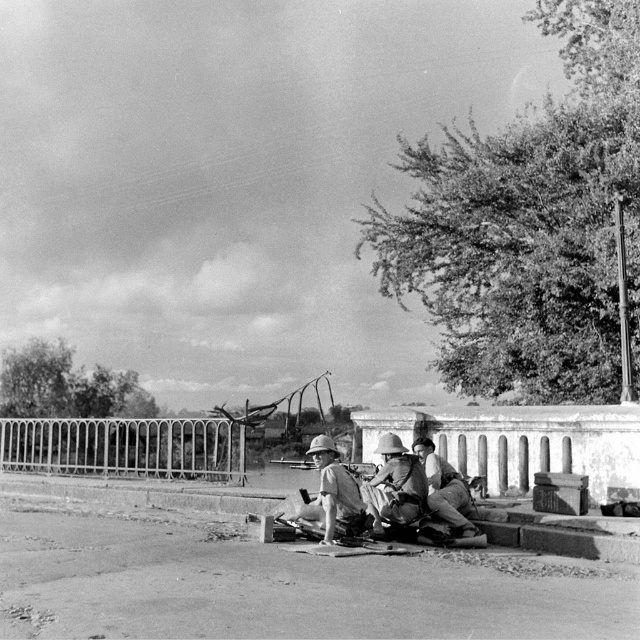
Question: Where is light brown wooden stick at center located in relation to camouflage fabric construction worker at center in the image?

Choices:
 (A) left
 (B) right

Answer: (A)

Question: Which point is closer to the camera?

Choices:
 (A) camouflage fabric construction worker at center
 (B) light brown wooden stick at center

Answer: (B)

Question: Is metallic wire fence at center to the left of camouflage fabric helmet at center from the viewer's perspective?

Choices:
 (A) yes
 (B) no

Answer: (A)

Question: Which object is the closest to the camouflage fabric helmet at center?

Choices:
 (A) metallic wire fence at center
 (B) light brown wooden stick at center

Answer: (B)

Question: Which object is positioned farthest from the metallic wire fence at center?

Choices:
 (A) camouflage fabric construction worker at center
 (B) camouflage fabric helmet at center
 (C) light brown wooden stick at center

Answer: (A)

Question: Is camouflage fabric helmet at center thinner than light brown wooden stick at center?

Choices:
 (A) yes
 (B) no

Answer: (B)